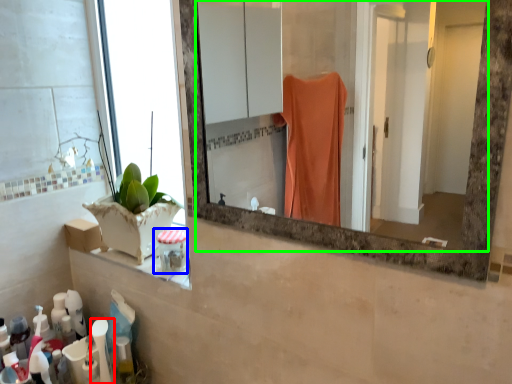
Question: Considering the real-world distances, which object is farthest from toiletry (highlighted by a red box)? toiletry (highlighted by a blue box) or mirror (highlighted by a green box)?

Choices:
 (A) toiletry
 (B) mirror

Answer: (B)